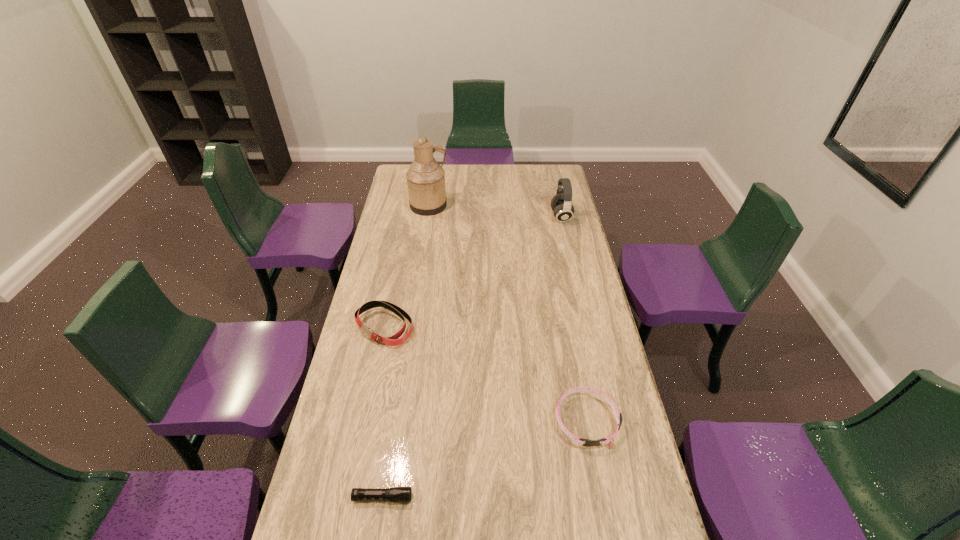
Locate an element on the screen. This screenshot has height=540, width=960. free space located 0.190m on the ear cups of the fourth shortest object is located at coordinates (510, 217).

Image resolution: width=960 pixels, height=540 pixels. In order to click on blank space located on the ear cups of the fourth shortest object in this screenshot , I will do `click(489, 217)`.

This screenshot has width=960, height=540. Identify the location of vacant space located 0.360m on the front of the taller dog collar. (359, 448).

Find the location of `vacant space positioned with the buckle on the right dog collar`. vacant space positioned with the buckle on the right dog collar is located at coordinates (605, 514).

This screenshot has width=960, height=540. In order to click on free space located 0.390m at the lens end of the flashlight in this screenshot , I will do `click(560, 498)`.

Find the location of a particular element. pitcher that is positioned at the left edge is located at coordinates (425, 178).

The width and height of the screenshot is (960, 540). In order to click on dog collar present at the left edge in this screenshot , I will do pos(393,340).

Locate an element on the screen. flashlight at the left edge is located at coordinates (394, 494).

Where is `headset located in the right edge section of the desktop`? headset located in the right edge section of the desktop is located at coordinates (561, 204).

The width and height of the screenshot is (960, 540). What are the coordinates of `dog collar present at the right edge` in the screenshot? It's located at (607, 440).